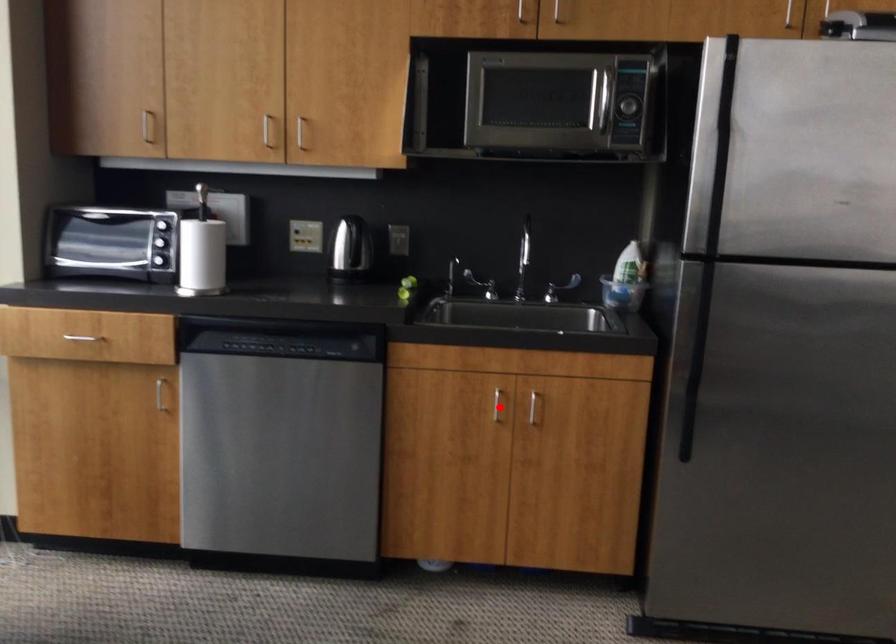
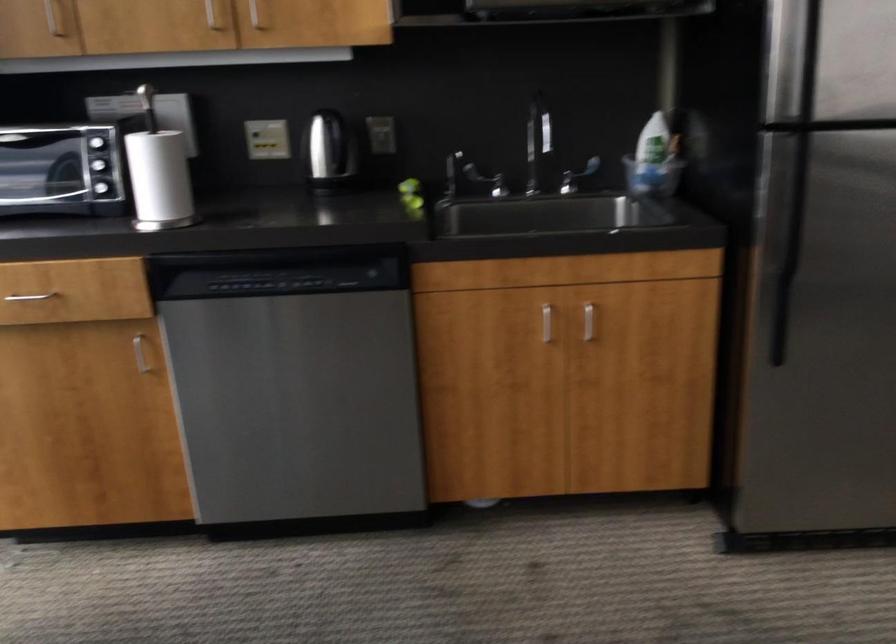
In the second image, find the point that corresponds to the highlighted location in the first image.

(546, 323)